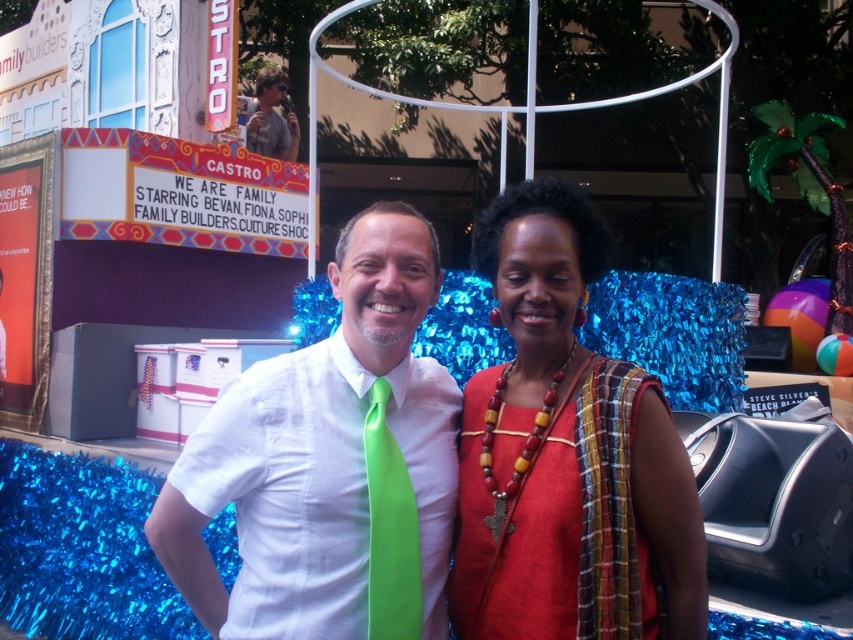
Question: Can you confirm if matte white shirt with green tie at center is positioned below matte green tie at center?

Choices:
 (A) yes
 (B) no

Answer: (A)

Question: Which of the following is the closest to the observer?

Choices:
 (A) (433, 444)
 (B) (489, 212)

Answer: (B)

Question: Which of the following is the closest to the observer?

Choices:
 (A) pos(277,513)
 (B) pos(370,593)

Answer: (B)

Question: Among these objects, which one is farthest from the camera?

Choices:
 (A) matte green tie at center
 (B) red fabric dress at center
 (C) matte white shirt with green tie at center
 (D) green satin tie at center

Answer: (A)

Question: In this image, where is matte white shirt with green tie at center located relative to matte green tie at center?

Choices:
 (A) above
 (B) below

Answer: (B)

Question: Observing the image, what is the correct spatial positioning of red fabric dress at center in reference to green satin tie at center?

Choices:
 (A) below
 (B) above

Answer: (B)